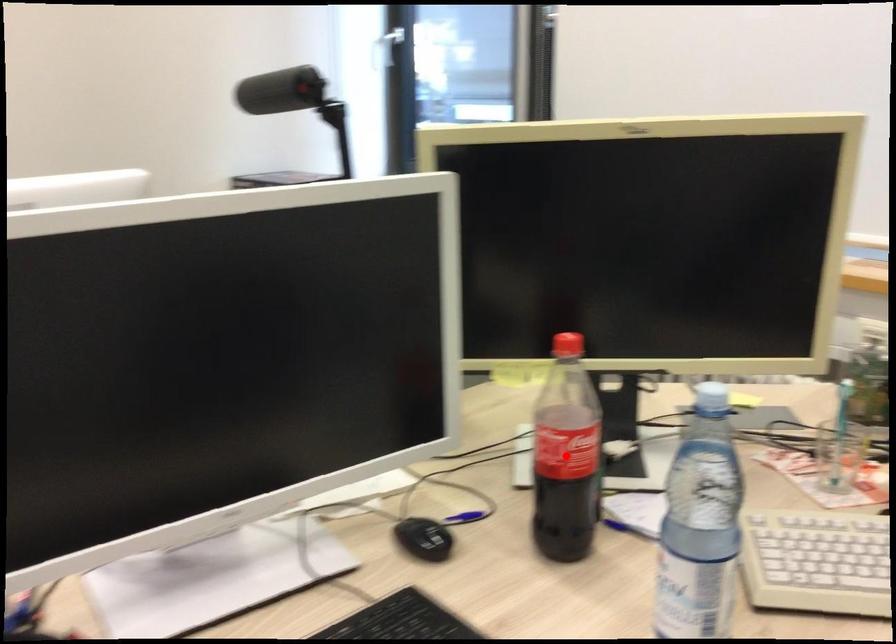
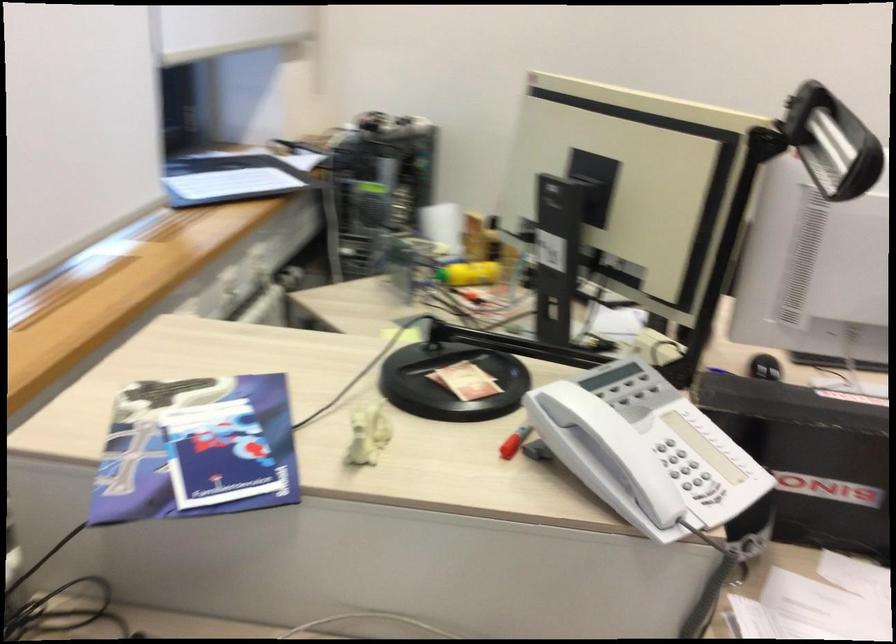
Question: I am providing you with two images of the same scene from different viewpoints. A red point is marked on the first image. At the location where the point appears in image 1, is it still visible in image 2?

Choices:
 (A) Yes
 (B) No

Answer: (B)